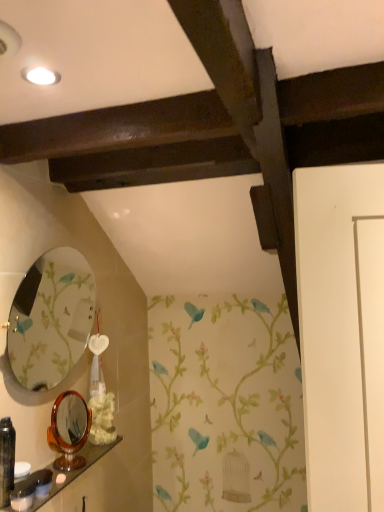
Question: Is white matte flower at lower center outside white glossy soap at lower left, which ranks as the second toiletry in right-to-left order?

Choices:
 (A) no
 (B) yes

Answer: (B)

Question: Is white matte flower at lower center positioned in front of white glossy soap at lower left, which ranks as the second toiletry in right-to-left order?

Choices:
 (A) yes
 (B) no

Answer: (B)

Question: Can you confirm if white matte flower at lower center is taller than white glossy soap at lower left, acting as the second toiletry starting from the left?

Choices:
 (A) yes
 (B) no

Answer: (A)

Question: Is white matte flower at lower center to the right of white glossy soap at lower left, acting as the second toiletry starting from the left, from the viewer's perspective?

Choices:
 (A) yes
 (B) no

Answer: (A)

Question: Does white matte flower at lower center have a smaller size compared to white glossy soap at lower left, which ranks as the second toiletry in right-to-left order?

Choices:
 (A) no
 (B) yes

Answer: (A)

Question: Is wooden polished shelf at lower left inside or outside of tortoiseshell mirror at lower left, the 2th mirror from the top?

Choices:
 (A) inside
 (B) outside

Answer: (B)

Question: Looking at the image, does wooden polished shelf at lower left seem bigger or smaller compared to tortoiseshell mirror at lower left, the first mirror from the bottom?

Choices:
 (A) small
 (B) big

Answer: (A)

Question: Based on their positions, is wooden polished shelf at lower left located to the left or right of tortoiseshell mirror at lower left, the first mirror from the bottom?

Choices:
 (A) left
 (B) right

Answer: (B)

Question: In terms of height, does wooden polished shelf at lower left look taller or shorter compared to tortoiseshell mirror at lower left, the 2th mirror from the top?

Choices:
 (A) short
 (B) tall

Answer: (A)

Question: From the image's perspective, is matte black toiletry at lower left, placed as the third toiletry when sorted from left to right, above or below tortoiseshell mirror at lower left, the first mirror from the bottom?

Choices:
 (A) above
 (B) below

Answer: (B)

Question: In the image, is matte black toiletry at lower left, placed as the third toiletry when sorted from left to right, positioned in front of or behind tortoiseshell mirror at lower left, the first mirror from the bottom?

Choices:
 (A) front
 (B) behind

Answer: (A)

Question: Does point (33, 473) appear closer or farther from the camera than point (59, 402)?

Choices:
 (A) closer
 (B) farther

Answer: (A)

Question: Considering the relative positions of matte black toiletry at lower left, placed as the third toiletry when sorted from left to right, and tortoiseshell mirror at lower left, the 2th mirror from the top, in the image provided, is matte black toiletry at lower left, placed as the third toiletry when sorted from left to right, to the left or to the right of tortoiseshell mirror at lower left, the 2th mirror from the top,?

Choices:
 (A) left
 (B) right

Answer: (A)

Question: Considering their positions, is matte black toiletry at lower left, the first toiletry when ordered from right to left, located in front of or behind black plastic bottle at lower left, the 1th toiletry from the left?

Choices:
 (A) behind
 (B) front

Answer: (A)

Question: Is matte black toiletry at lower left, placed as the third toiletry when sorted from left to right, inside the boundaries of black plastic bottle at lower left, the 3th toiletry when ordered from right to left, or outside?

Choices:
 (A) inside
 (B) outside

Answer: (B)